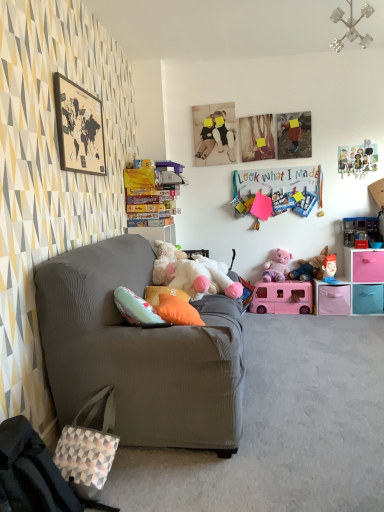
Question: From the image's perspective, relative to metallic plastic toy at upper right, arranged as the sixth toy when viewed from the left, is pink plastic van at center, positioned as the 3th toy in left-to-right order, above or below?

Choices:
 (A) below
 (B) above

Answer: (A)

Question: In terms of size, does pink plastic van at center, positioned as the 3th toy in left-to-right order, appear bigger or smaller than metallic plastic toy at upper right, arranged as the sixth toy when viewed from the left?

Choices:
 (A) small
 (B) big

Answer: (B)

Question: Estimate the real-world distances between objects in this image. Which object is farther from the wooden map at upper left?

Choices:
 (A) matte plastic toy at right, which is the 2th toy in right-to-left order
 (B) fluffy white teddy bear at center, marked as the 6th toy in a right-to-left arrangement
 (C) orange fabric pillow at center
 (D) plush pink teddy bear at right, the 3th toy in the right-to-left sequence
 (E) plush purple bear at center-right, positioned as the 5th toy in right-to-left order

Answer: (A)

Question: Which object is positioned farthest from the metallic plastic toy at upper right, arranged as the sixth toy when viewed from the left?

Choices:
 (A) matte plastic toy at right, the 5th toy from the left
 (B) wooden map at upper left
 (C) plush purple bear at center-right, positioned as the 5th toy in right-to-left order
 (D) plush pink teddy bear at right, which is the 4th toy in left-to-right order
 (E) orange fabric pillow at center

Answer: (B)